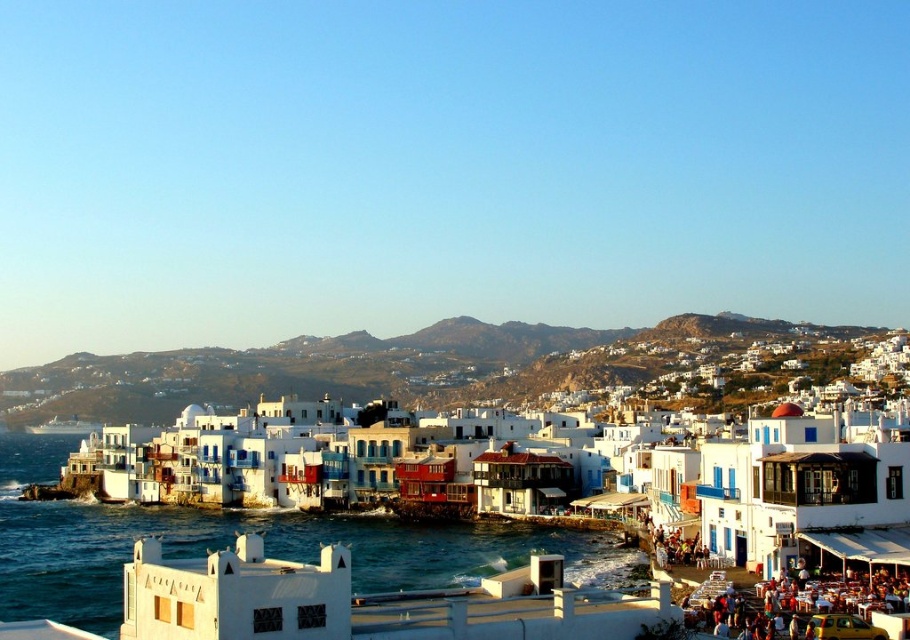
Which is behind, point (583, 445) or point (44, 544)?

The point (583, 445) is more distant.

Who is taller, white painted buildings at center or clear blue water at lower center?

With more height is clear blue water at lower center.

I want to click on white painted buildings at center, so click(555, 456).

Find the location of a particular element. The height and width of the screenshot is (640, 910). white painted buildings at center is located at coordinates (555, 456).